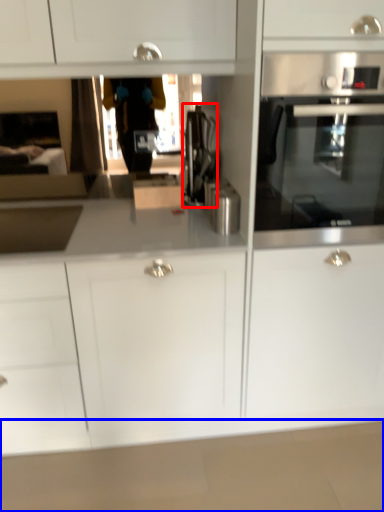
Question: Which point is further to the camera, coffee machine (highlighted by a red box) or counter top (highlighted by a blue box)?

Choices:
 (A) coffee machine
 (B) counter top

Answer: (A)